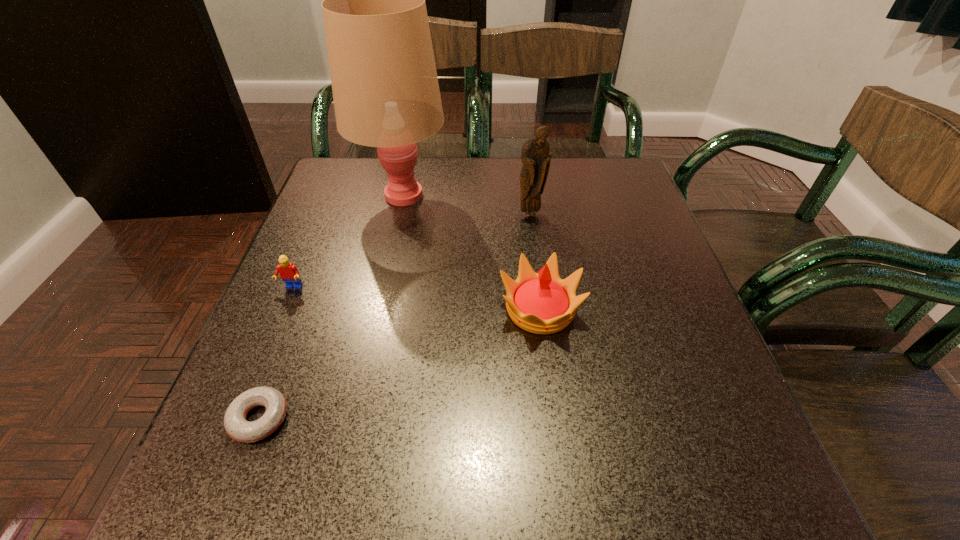
Identify the location of lampshade. This screenshot has width=960, height=540. (386, 94).

You are a GUI agent. You are given a task and a screenshot of the screen. Output one action in this format:
    pyautogui.click(x=<x>, y=<y>)
    Task: Click on the figurine
    
    Given the screenshot: What is the action you would take?
    pyautogui.click(x=535, y=157)

This screenshot has height=540, width=960. What are the coordinates of `the third shortest object` in the screenshot? It's located at (542, 303).

Image resolution: width=960 pixels, height=540 pixels. Find the location of `the fourth tallest object`. the fourth tallest object is located at coordinates (289, 274).

Locate an element on the screen. the shortest object is located at coordinates (237, 427).

Find the location of a particular element. This screenshot has height=540, width=960. doughnut is located at coordinates (237, 427).

This screenshot has height=540, width=960. I want to click on free space located 0.100m on the right of the lampshade, so click(x=488, y=194).

You are a GUI agent. You are given a task and a screenshot of the screen. Output one action in this format:
    pyautogui.click(x=<x>, y=<y>)
    Task: Click on the vacant point located 0.110m on the front-facing side of the second tallest object
    
    Given the screenshot: What is the action you would take?
    pyautogui.click(x=535, y=249)

The image size is (960, 540). Identify the location of free space located 0.250m on the front of the crown. (563, 487).

Where is `vacant space located 0.180m on the front-facing side of the second shortest object`? Image resolution: width=960 pixels, height=540 pixels. vacant space located 0.180m on the front-facing side of the second shortest object is located at coordinates (258, 370).